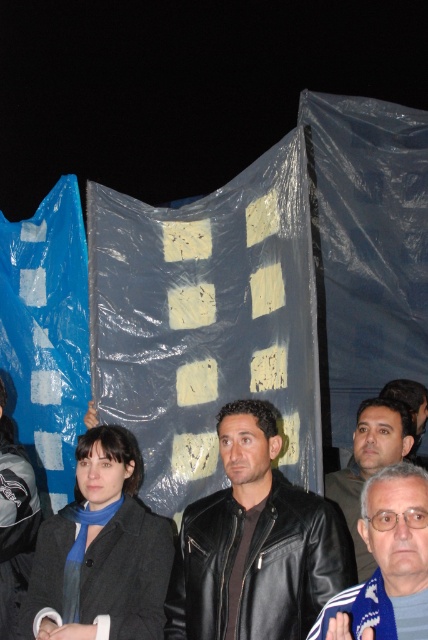
Question: Among these objects, which one is nearest to the camera?

Choices:
 (A) black leather jacket at center
 (B) dark brown leather jacket at lower right

Answer: (A)

Question: Which object is the farthest from the dark brown leather jacket at lower right?

Choices:
 (A) matte black leather jacket at center
 (B) black leather jacket at center

Answer: (A)

Question: Can you confirm if black leather jacket at center is positioned above matte black leather jacket at center?

Choices:
 (A) no
 (B) yes

Answer: (A)

Question: Which of the following is the closest to the observer?

Choices:
 (A) dark brown leather jacket at lower right
 (B) dark gray wool coat at lower left
 (C) matte black leather jacket at center

Answer: (C)

Question: Considering the relative positions of black leather jacket at center and black leather jacket at lower left in the image provided, where is black leather jacket at center located with respect to black leather jacket at lower left?

Choices:
 (A) right
 (B) left

Answer: (A)

Question: Where is dark gray wool coat at lower left located in relation to dark brown leather jacket at lower right in the image?

Choices:
 (A) above
 (B) below

Answer: (B)